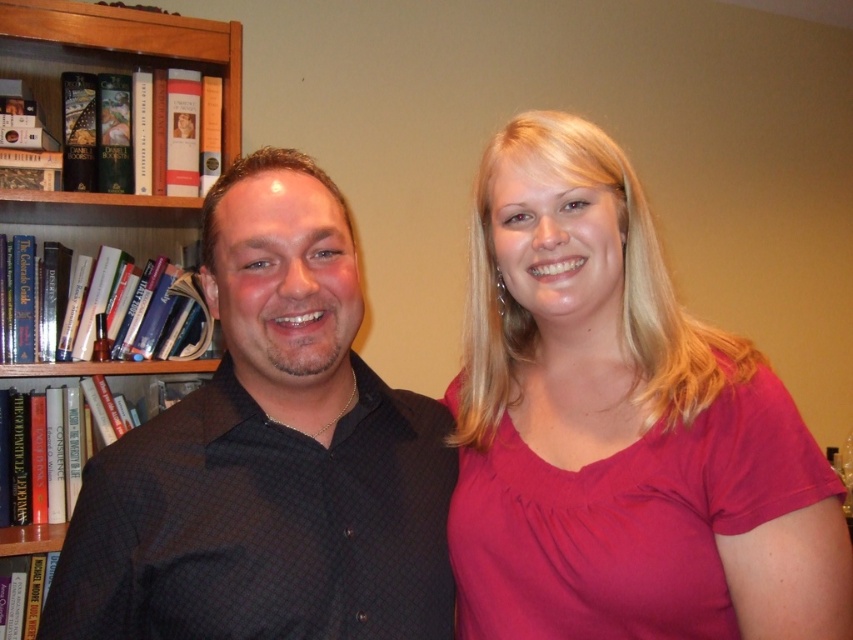
Question: Which of the following is the farthest from the observer?

Choices:
 (A) pink fabric shirt at right
 (B) black dotted shirt at left
 (C) wooden bookcase at left

Answer: (C)

Question: Can you confirm if black dotted shirt at left is positioned above wooden bookcase at left?

Choices:
 (A) yes
 (B) no

Answer: (B)

Question: Among these points, which one is farthest from the camera?

Choices:
 (A) (172, 35)
 (B) (668, 573)
 (C) (387, 413)

Answer: (A)

Question: Which object is the farthest from the pink fabric shirt at right?

Choices:
 (A) wooden bookcase at left
 (B) black dotted shirt at left

Answer: (A)

Question: Can you confirm if pink fabric shirt at right is wider than wooden bookcase at left?

Choices:
 (A) yes
 (B) no

Answer: (B)

Question: Is black dotted shirt at left above wooden bookcase at left?

Choices:
 (A) no
 (B) yes

Answer: (A)